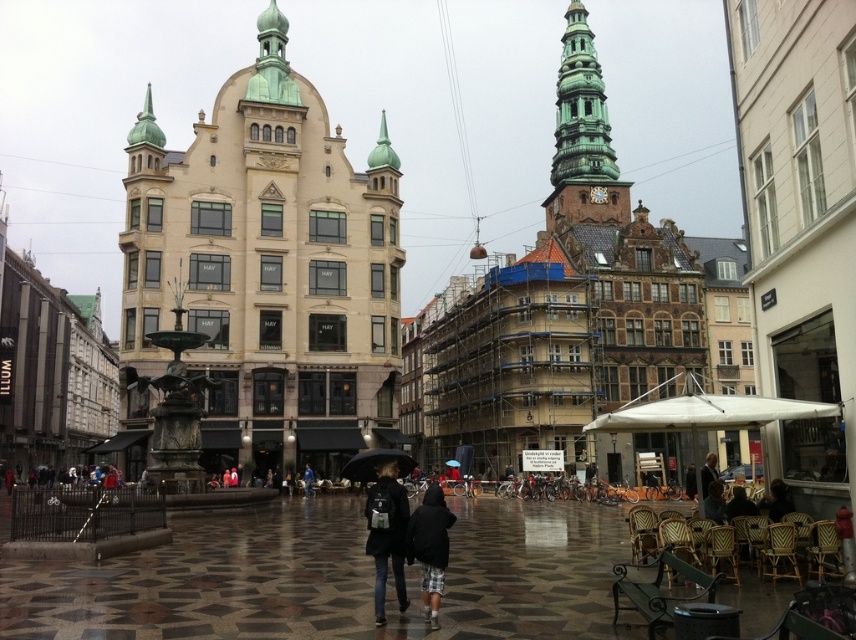
Is green copper tower at upper center above dark gray backpack at center?

Correct, green copper tower at upper center is located above dark gray backpack at center.

Which is in front, point (586, 88) or point (376, 531)?

Point (376, 531) is more forward.

Where is `green copper tower at upper center`? The image size is (856, 640). green copper tower at upper center is located at coordinates (583, 136).

Is point (379, 496) positioned behind point (437, 540)?

Yes, it is.

This screenshot has width=856, height=640. Find the location of `dark gray backpack at center`. dark gray backpack at center is located at coordinates (406, 540).

Can you confirm if beige stone building at center is thinner than black matte umbrella at center?

In fact, beige stone building at center might be wider than black matte umbrella at center.

You are a GUI agent. You are given a task and a screenshot of the screen. Output one action in this format:
    pyautogui.click(x=<x>, y=<y>)
    Task: Click on the beige stone building at center
    This screenshot has height=640, width=856.
    Given the screenshot: What is the action you would take?
    pyautogui.click(x=268, y=269)